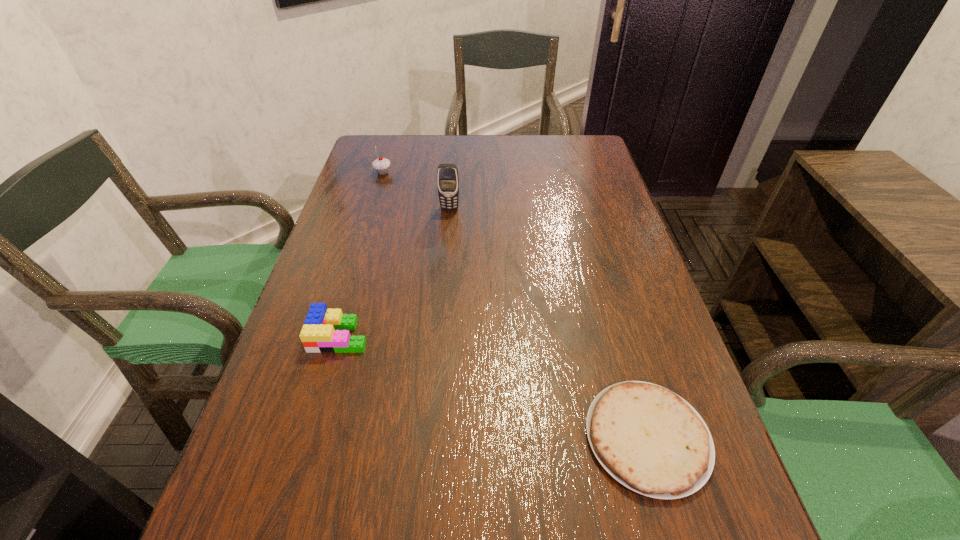
Locate an element on the screen. This screenshot has width=960, height=540. object that stands as the closest to the nearest object is located at coordinates (325, 330).

This screenshot has width=960, height=540. I want to click on the closest object relative to the third shortest object, so 447,174.

Find the location of a particular element. vacant point that satisfies the following two spatial constraints: 1. on the front face of the rightmost object; 2. on the left side of the second farthest object is located at coordinates (430, 437).

Image resolution: width=960 pixels, height=540 pixels. What are the coordinates of `vacant space that satisfies the following two spatial constraints: 1. on the front face of the second object from right to left; 2. on the right side of the tortilla` in the screenshot? It's located at (430, 437).

Where is `vacant point that satisfies the following two spatial constraints: 1. on the front side of the second nearest object; 2. on the left side of the cupcake`? This screenshot has height=540, width=960. vacant point that satisfies the following two spatial constraints: 1. on the front side of the second nearest object; 2. on the left side of the cupcake is located at coordinates (334, 335).

The width and height of the screenshot is (960, 540). What are the coordinates of `free region that satisfies the following two spatial constraints: 1. on the front side of the Lego; 2. on the right side of the second tallest object` in the screenshot? It's located at click(x=334, y=335).